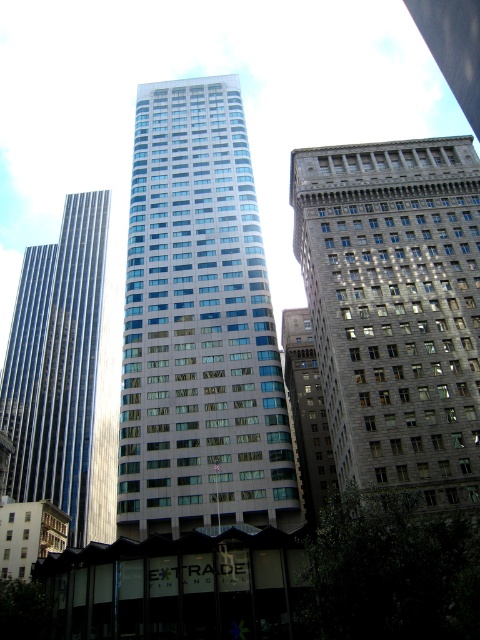
Who is positioned more to the left, gray stone building at center or dark gray stone building at center?

From the viewer's perspective, dark gray stone building at center appears more on the left side.

Who is more forward, (333, 444) or (285, 355)?

Positioned in front is point (333, 444).

Is point (379, 348) closer to viewer compared to point (330, 464)?

Yes, point (379, 348) is closer to viewer.

Where is `gray stone building at center`? The width and height of the screenshot is (480, 640). gray stone building at center is located at coordinates (396, 308).

Locate an element on the screen. The width and height of the screenshot is (480, 640). shiny metallic skyscraper at left is located at coordinates (64, 374).

Who is more forward, [40,336] or [321,436]?

Point [321,436] is in front.

Who is more forward, (69, 330) or (307, 496)?

Point (307, 496) is in front.

Locate an element on the screen. This screenshot has width=480, height=640. shiny metallic skyscraper at left is located at coordinates (64, 374).

Is glassy reflective skyscraper at center to the left of shiny metallic skyscraper at left from the viewer's perspective?

Incorrect, glassy reflective skyscraper at center is not on the left side of shiny metallic skyscraper at left.

Does point (176, 486) come behind point (86, 484)?

No.

At what (x,y) coordinates should I click in order to perform the action: click on glassy reflective skyscraper at center. Please return your answer as a coordinate pair (x, y). This screenshot has width=480, height=640. Looking at the image, I should click on (199, 326).